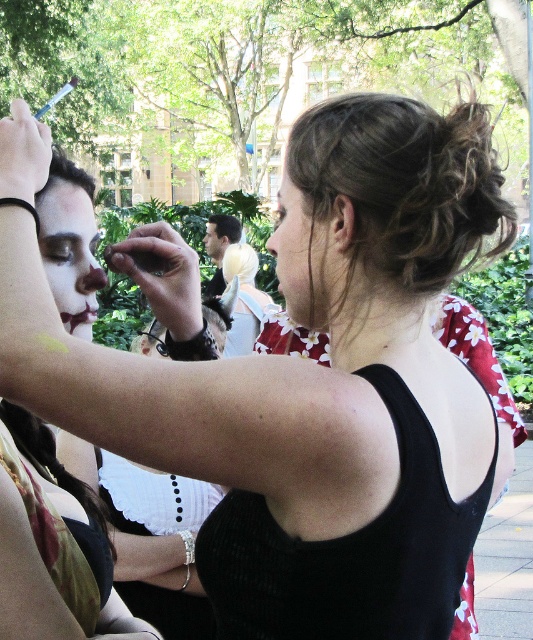
Question: Which object is closer to the camera taking this photo?

Choices:
 (A) white matte face paint at upper left
 (B) matte black face paint at center
 (C) matte floral dress at center
 (D) matte white eyebrow at upper left

Answer: (C)

Question: Does matte floral dress at center appear under matte black face paint at center?

Choices:
 (A) no
 (B) yes

Answer: (B)

Question: From the image, what is the correct spatial relationship of white matte face paint at upper left in relation to matte floral dress at center?

Choices:
 (A) below
 (B) above

Answer: (A)

Question: Which object is positioned closest to the matte black face paint at center?

Choices:
 (A) matte floral dress at center
 (B) matte white face at center

Answer: (B)

Question: Does matte floral dress at center appear on the left side of matte white face at center?

Choices:
 (A) yes
 (B) no

Answer: (B)

Question: Which is nearer to the matte white eyebrow at upper left?

Choices:
 (A) matte black face paint at center
 (B) matte floral dress at center
 (C) matte white face at center
 (D) white matte face paint at upper left

Answer: (D)